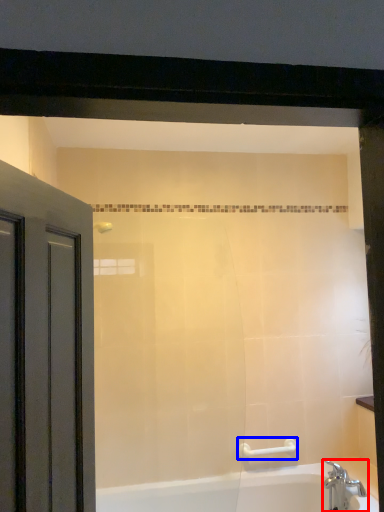
Question: Which of the following is the farthest to the observer, tap (highlighted by a red box) or towel bar (highlighted by a blue box)?

Choices:
 (A) tap
 (B) towel bar

Answer: (B)